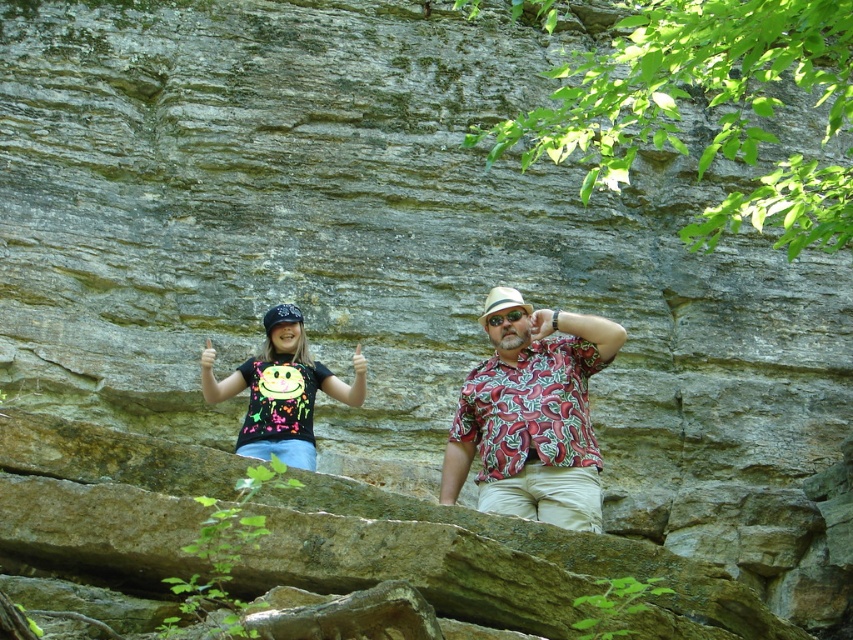
Question: Does black printed shirt at center appear on the left side of neon fabric shirt at lower left?

Choices:
 (A) yes
 (B) no

Answer: (B)

Question: Which object appears farthest from the camera in this image?

Choices:
 (A) black printed shirt at center
 (B) neon fabric shirt at lower left
 (C) printed fabric shirt at center

Answer: (B)

Question: Considering the relative positions of printed fabric shirt at center and neon fabric shirt at lower left in the image provided, where is printed fabric shirt at center located with respect to neon fabric shirt at lower left?

Choices:
 (A) below
 (B) above

Answer: (B)

Question: Which object appears farthest from the camera in this image?

Choices:
 (A) neon fabric shirt at lower left
 (B) printed fabric shirt at center
 (C) black printed shirt at center

Answer: (A)

Question: Which point is closer to the camera taking this photo?

Choices:
 (A) (509, 330)
 (B) (288, 371)

Answer: (A)

Question: Does black printed shirt at center have a larger size compared to printed fabric shirt at center?

Choices:
 (A) yes
 (B) no

Answer: (A)